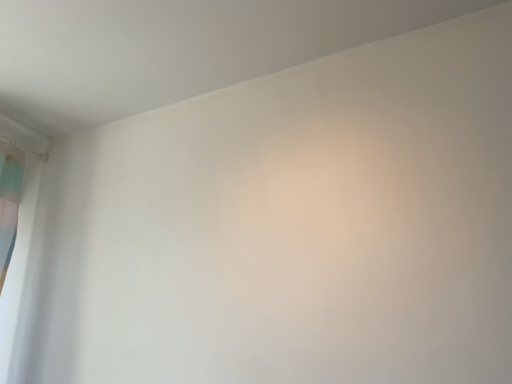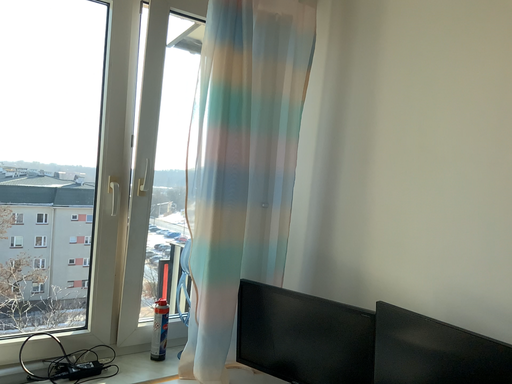
Question: How did the camera likely rotate when shooting the video?

Choices:
 (A) rotated right
 (B) rotated left

Answer: (B)